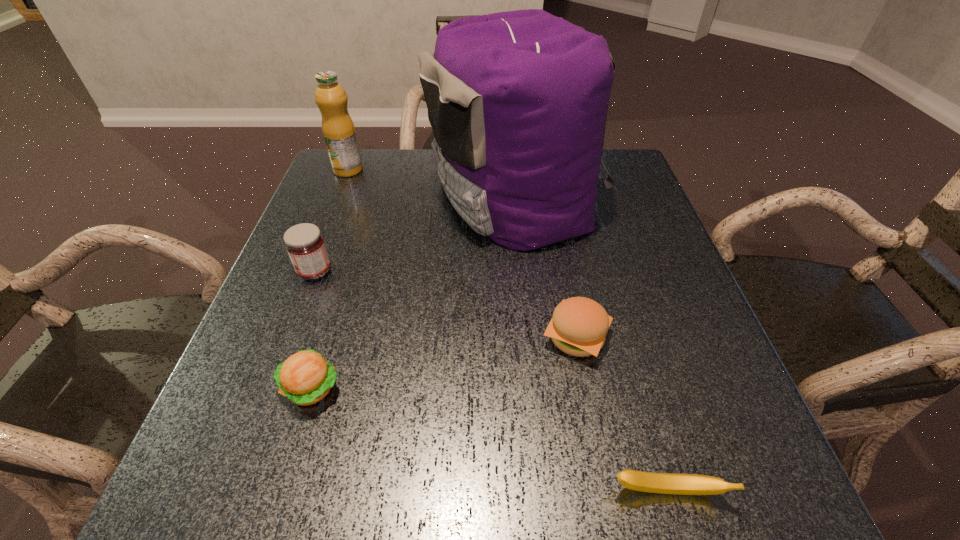
Where is `free space that is in between the nearest object and the jam`? This screenshot has width=960, height=540. free space that is in between the nearest object and the jam is located at coordinates (492, 382).

The image size is (960, 540). I want to click on vacant space that's between the tallest object and the left hamburger, so click(413, 292).

Where is `vacant area that lies between the tallest object and the jam`? The height and width of the screenshot is (540, 960). vacant area that lies between the tallest object and the jam is located at coordinates (415, 234).

Locate an element on the screen. The image size is (960, 540). vacant region between the backpack and the left hamburger is located at coordinates (413, 292).

Identify the location of vacant point located between the right hamburger and the fifth shortest object. Image resolution: width=960 pixels, height=540 pixels. (462, 254).

Locate an element on the screen. free spot between the tallest object and the fruit juice is located at coordinates (431, 183).

Locate an element on the screen. The width and height of the screenshot is (960, 540). free point between the tallest object and the fifth shortest object is located at coordinates (431, 183).

Locate an element on the screen. free area in between the left hamburger and the fruit juice is located at coordinates (x=329, y=279).

Where is `the fifth closest object to the fourth shortest object`? the fifth closest object to the fourth shortest object is located at coordinates (664, 483).

The image size is (960, 540). In order to click on object that is the fourth nearest to the fruit juice in this screenshot , I will do `click(579, 325)`.